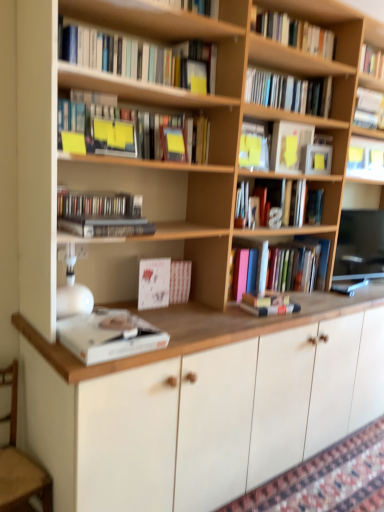
Describe the element at coordinates (135, 126) in the screenshot. I see `matte yellow sticky notes at upper center, the 7th book ordered from the bottom` at that location.

At what (x,y) coordinates should I click in order to perform the action: click on white textured book at center, acting as the tenth book starting from the top. Please return your answer as a coordinate pair (x, y). The width and height of the screenshot is (384, 512). Looking at the image, I should click on (163, 282).

Which of these two, hardcover book at center, arranged as the 4th book when ordered from the bottom, or wooden armchair at lower left, is thinner?

hardcover book at center, arranged as the 4th book when ordered from the bottom, is thinner.

Is wooden armchair at lower left located within hardcover book at center, arranged as the 4th book when ordered from the bottom?

No, hardcover book at center, arranged as the 4th book when ordered from the bottom, does not contain wooden armchair at lower left.

Considering the sizes of hardcover book at center, which is the 9th book in top-to-bottom order, and wooden armchair at lower left in the image, is hardcover book at center, which is the 9th book in top-to-bottom order, bigger or smaller than wooden armchair at lower left?

In the image, hardcover book at center, which is the 9th book in top-to-bottom order, appears to be smaller than wooden armchair at lower left.

Are wooden armchair at lower left and hardcover books at upper right, which ranks as the eleventh book in bottom-to-top order, beside each other?

No, wooden armchair at lower left is not beside hardcover books at upper right, which ranks as the eleventh book in bottom-to-top order.

What's the angular difference between wooden armchair at lower left and hardcover books at upper right, which ranks as the eleventh book in bottom-to-top order,'s facing directions?

The facing directions of wooden armchair at lower left and hardcover books at upper right, which ranks as the eleventh book in bottom-to-top order, are 3.81 degrees apart.

Is wooden armchair at lower left aimed at hardcover books at upper right, which ranks as the eleventh book in bottom-to-top order?

No, wooden armchair at lower left is not facing towards hardcover books at upper right, which ranks as the eleventh book in bottom-to-top order.

Between wooden armchair at lower left and hardcover books at upper right, placed as the second book when sorted from top to bottom, which one appears on the right side from the viewer's perspective?

Positioned to the right is hardcover books at upper right, placed as the second book when sorted from top to bottom.

Between hardcover book at center, which is counted as the 7th book, starting from the top, and patterned carpet at lower right, which one appears on the right side from the viewer's perspective?

From the viewer's perspective, patterned carpet at lower right appears more on the right side.

From a real-world perspective, is hardcover book at center, which is counted as the 7th book, starting from the top, below patterned carpet at lower right?

Actually, hardcover book at center, which is counted as the 7th book, starting from the top, is physically above patterned carpet at lower right in the real world.

Is hardcover book at center, which ranks as the 6th book in bottom-to-top order, taller than patterned carpet at lower right?

Correct, hardcover book at center, which ranks as the 6th book in bottom-to-top order, is much taller as patterned carpet at lower right.

Looking at this image, what's the angular difference between hardcover book at center, which is counted as the 7th book, starting from the top, and patterned carpet at lower right's facing directions?

hardcover book at center, which is counted as the 7th book, starting from the top, and patterned carpet at lower right are facing 4.4 degrees away from each other.

Find the location of a particular element. The width and height of the screenshot is (384, 512). book that is the 3rd one when counting forward from the patterned carpet at lower right is located at coordinates (106, 226).

Is hardcover book at center, which is the 9th book in top-to-bottom order, closer to the viewer compared to patterned carpet at lower right?

Yes, the depth of hardcover book at center, which is the 9th book in top-to-bottom order, is less than that of patterned carpet at lower right.

Which of these two, hardcover book at center, which is the 9th book in top-to-bottom order, or patterned carpet at lower right, stands taller?

hardcover book at center, which is the 9th book in top-to-bottom order, is taller.

Measure the distance from hardcover books at upper center, positioned as the 4th book in top-to-bottom order, to white matte book at lower left, positioned as the 1th book in bottom-to-top order.

A distance of 3.31 feet exists between hardcover books at upper center, positioned as the 4th book in top-to-bottom order, and white matte book at lower left, positioned as the 1th book in bottom-to-top order.

Which point is more distant from viewer, (110, 48) or (59, 322)?

→ The point (110, 48) is farther.

Does hardcover books at upper center, positioned as the 4th book in top-to-bottom order, have a greater height compared to white matte book at lower left, positioned as the 1th book in bottom-to-top order?

Correct, hardcover books at upper center, positioned as the 4th book in top-to-bottom order, is much taller as white matte book at lower left, positioned as the 1th book in bottom-to-top order.

From the image's perspective, does hardcover books at upper center, marked as the 9th book in a bottom-to-top arrangement, appear lower than white matte book at lower left, positioned as the 1th book in bottom-to-top order?

Incorrect, from the image's perspective, hardcover books at upper center, marked as the 9th book in a bottom-to-top arrangement, is higher than white matte book at lower left, positioned as the 1th book in bottom-to-top order.

Is hardcover books at upper right, which ranks as the eleventh book in bottom-to-top order, looking in the opposite direction of hardcover book at center, which is counted as the 7th book, starting from the top?

hardcover books at upper right, which ranks as the eleventh book in bottom-to-top order, does not have its back to hardcover book at center, which is counted as the 7th book, starting from the top.

In the scene shown: How different are the orientations of hardcover books at upper right, which ranks as the eleventh book in bottom-to-top order, and hardcover book at center, which is counted as the 7th book, starting from the top, in degrees?

They differ by 0.39 degrees in their facing directions.

Between point (330, 82) and point (290, 216), which one is positioned behind?

The point (290, 216) is farther from the camera.

Based on the photo, in terms of size, does hardcover books at upper right, which ranks as the eleventh book in bottom-to-top order, appear bigger or smaller than hardcover book at center, which ranks as the 6th book in bottom-to-top order?

hardcover books at upper right, which ranks as the eleventh book in bottom-to-top order, is bigger than hardcover book at center, which ranks as the 6th book in bottom-to-top order.

Is matte yellow sticky notes at upper center, marked as the 6th book in a top-to-bottom arrangement, positioned far away from wooden armchair at lower left?

Yes, matte yellow sticky notes at upper center, marked as the 6th book in a top-to-bottom arrangement, and wooden armchair at lower left are located far from each other.

Which object is more forward, matte yellow sticky notes at upper center, marked as the 6th book in a top-to-bottom arrangement, or wooden armchair at lower left?

wooden armchair at lower left is in front.

Locate an element on the screen. The width and height of the screenshot is (384, 512). book that is the 8th object above the wooden armchair at lower left (from a real-world perspective) is located at coordinates (135, 126).

From the picture: Is matte yellow sticky notes at upper center, marked as the 6th book in a top-to-bottom arrangement, turned away from wooden armchair at lower left?

No.

Locate an element on the screen. This screenshot has height=512, width=384. armchair below the hardcover book at center, which is the 9th book in top-to-bottom order (from a real-world perspective) is located at coordinates (20, 462).

The height and width of the screenshot is (512, 384). What are the coordinates of `armchair in front of the hardcover books at upper right, which ranks as the eleventh book in bottom-to-top order` in the screenshot? It's located at (20, 462).

From the image, which object appears to be farther from white matte cabinet at center, hardcover book at upper right, the 5th book viewed from the top, or wooden armchair at lower left?

hardcover book at upper right, the 5th book viewed from the top, is positioned further to the anchor white matte cabinet at center.

In the scene shown: When comparing their distances from white matte cabinet at center, does wooden armchair at lower left or white matte book at lower left, which is the twelfth book in top-to-bottom order, seem closer?

white matte book at lower left, which is the twelfth book in top-to-bottom order, lies closer to white matte cabinet at center than the other object.

Which object lies further to the anchor point hardcover book at upper right, the 5th book viewed from the top, hardcover book at upper right, the 3th book from the top, or hardcover book at center, which is counted as the 2th book, starting from the bottom?

hardcover book at center, which is counted as the 2th book, starting from the bottom, lies further to hardcover book at upper right, the 5th book viewed from the top, than the other object.

Considering their positions, is hardcover books at upper right, placed as the second book when sorted from top to bottom, positioned further to hardcover book at upper right, the 1th book in the top-to-bottom sequence, than matte black compact disc case at left, acting as the 8th book starting from the top?

matte black compact disc case at left, acting as the 8th book starting from the top, is further to hardcover book at upper right, the 1th book in the top-to-bottom sequence.

In the scene shown: Looking at the image, which one is located closer to hardcover books at upper center, marked as the 9th book in a bottom-to-top arrangement, wooden armchair at lower left or hardcover books at upper right, placed as the second book when sorted from top to bottom?

hardcover books at upper right, placed as the second book when sorted from top to bottom, lies closer to hardcover books at upper center, marked as the 9th book in a bottom-to-top arrangement, than the other object.

Based on their spatial positions, is hardcover book at center, which is counted as the 2th book, starting from the bottom, or hardcover book at upper right, which is the 10th book from bottom to top, closer to matte white paperback book at upper right?

hardcover book at upper right, which is the 10th book from bottom to top, lies closer to matte white paperback book at upper right than the other object.

Estimate the real-world distances between objects in this image. Which object is closer to wooden armchair at lower left, hardcover book at center, arranged as the 4th book when ordered from the bottom, or hardcover book at center, which ranks as the 6th book in bottom-to-top order?

hardcover book at center, arranged as the 4th book when ordered from the bottom.

Estimate the real-world distances between objects in this image. Which object is closer to hardcover books at upper center, positioned as the 4th book in top-to-bottom order, hardcover book at upper right, the 12th book ordered from the bottom, or hardcover book at upper right, the 5th book viewed from the top?

The object closer to hardcover books at upper center, positioned as the 4th book in top-to-bottom order, is hardcover book at upper right, the 12th book ordered from the bottom.

Where is `armchair between hardcover book at upper right, the 3th book from the top, and patterned carpet at lower right vertically`? The image size is (384, 512). armchair between hardcover book at upper right, the 3th book from the top, and patterned carpet at lower right vertically is located at coordinates (20, 462).

I want to click on paperback book between hardcover books at upper center, marked as the 9th book in a bottom-to-top arrangement, and wooden armchair at lower left vertically, so click(x=289, y=145).

Where is `cabinetry between hardcover book at center, which is counted as the 7th book, starting from the top, and patterned carpet at lower right from top to bottom`? This screenshot has width=384, height=512. cabinetry between hardcover book at center, which is counted as the 7th book, starting from the top, and patterned carpet at lower right from top to bottom is located at coordinates (200, 406).

Find the location of a particular element. Image resolution: width=384 pixels, height=512 pixels. cabinetry between hardcover book at upper right, which is counted as the 8th book, starting from the bottom, and patterned carpet at lower right from top to bottom is located at coordinates [x=200, y=406].